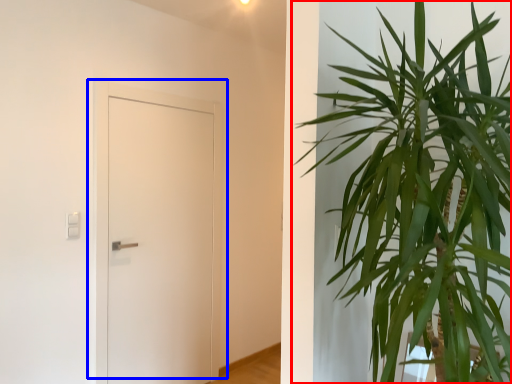
Question: Which object is closer to the camera taking this photo, houseplant (highlighted by a red box) or door (highlighted by a blue box)?

Choices:
 (A) houseplant
 (B) door

Answer: (A)